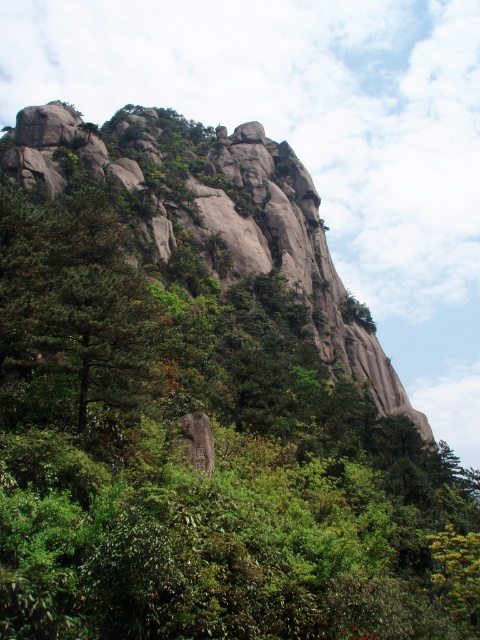
You are standing at the center of the image and want to locate the green matte tree at left. In which direction should you look to find it?

The green matte tree at left is located at point (75, 316), which is to the left side of the image. Therefore, you should look to the left to find it.

Based on the photo, you are a hiker trying to climb the rocks in the image. You see the gray rock at upper center and the rough gray rock at center. Which rock would you need to climb over first?

The rough gray rock at center is lower than the gray rock at upper center, so you would need to climb over the rough gray rock at center first before reaching the higher one.

From the picture: You are standing at the base of the towering rock formation and want to reach the top. You notice two points marked on the rock face. Which point is closer to you, point (384, 401) or point (96, 236)?

Point (384, 401) is further to the viewer than point (96, 236), so point (96, 236) is closer to you.